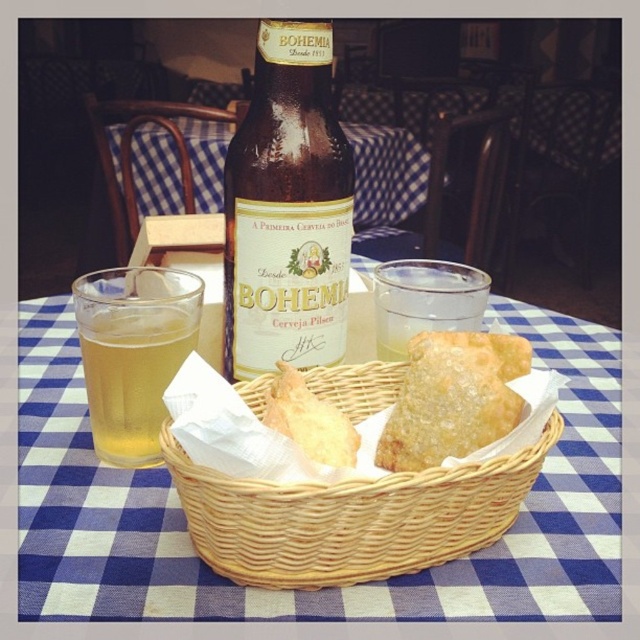
Question: Does brown glass bottle at center appear on the right side of translucent glass at left?

Choices:
 (A) no
 (B) yes

Answer: (B)

Question: Which object is the closest to the woven wood basket at center?

Choices:
 (A) golden crispy samosa at center
 (B) brown glass bottle at center
 (C) golden crispy pastry at center

Answer: (C)

Question: Which point appears closest to the camera in this image?

Choices:
 (A) (419, 360)
 (B) (273, 545)
 (C) (141, 413)
 (D) (301, 401)

Answer: (B)

Question: Considering the relative positions of woven wood basket at center and translucent glass at left in the image provided, where is woven wood basket at center located with respect to translucent glass at left?

Choices:
 (A) left
 (B) right

Answer: (B)

Question: Among these objects, which one is nearest to the camera?

Choices:
 (A) woven wood basket at center
 (B) golden crispy samosa at center

Answer: (A)

Question: Considering the relative positions of clear glass at center and golden crispy pastry at center in the image provided, where is clear glass at center located with respect to golden crispy pastry at center?

Choices:
 (A) left
 (B) right

Answer: (B)